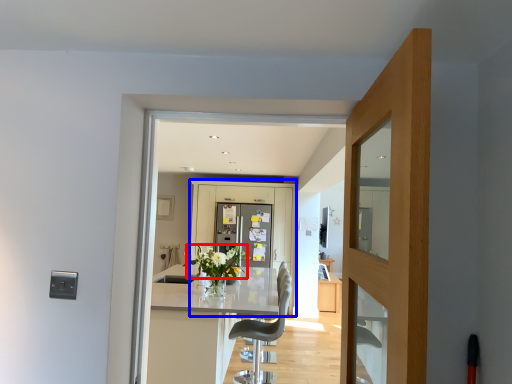
Question: Which object is further to the camera taking this photo, flower (highlighted by a red box) or barn door (highlighted by a blue box)?

Choices:
 (A) flower
 (B) barn door

Answer: (B)